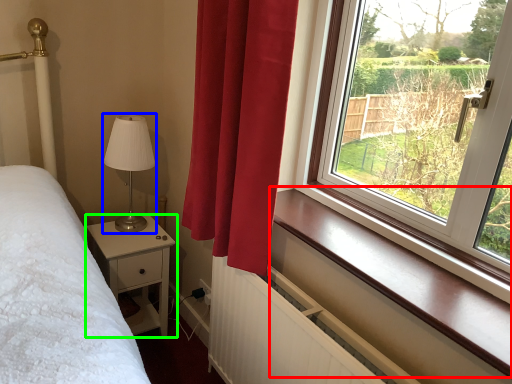
Question: Which object is positioned farthest from window sill (highlighted by a red box)? Select from table lamp (highlighted by a blue box) and nightstand (highlighted by a green box).

Choices:
 (A) table lamp
 (B) nightstand

Answer: (A)